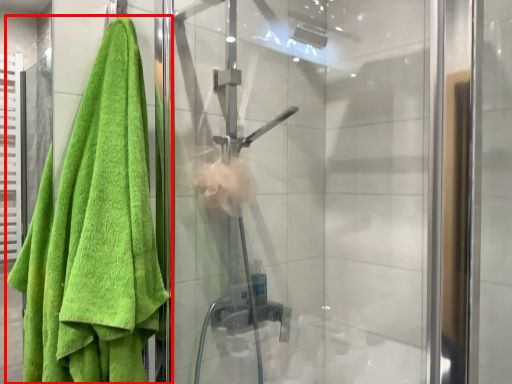
Question: Where is towel (annotated by the red box) located in relation to screen door in the image?

Choices:
 (A) left
 (B) right

Answer: (A)